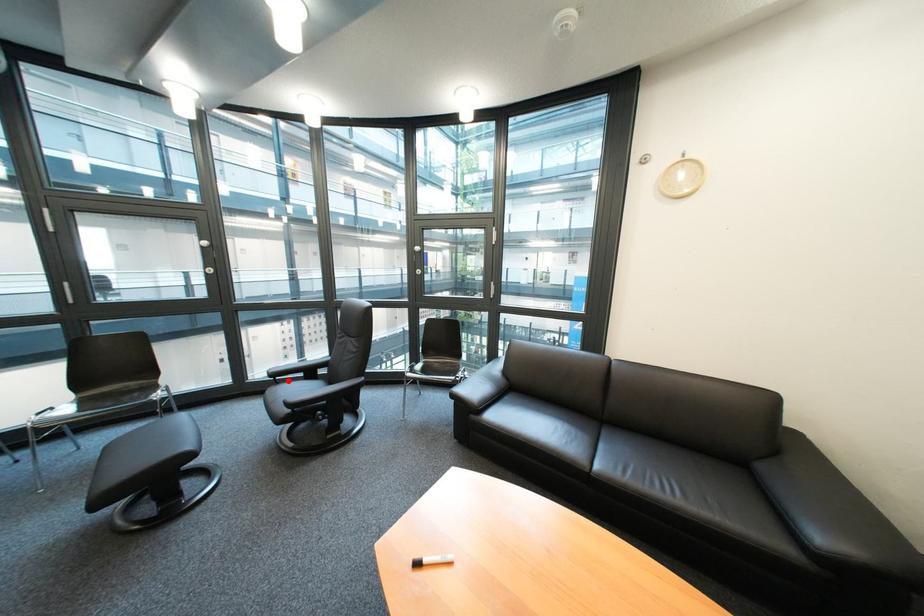
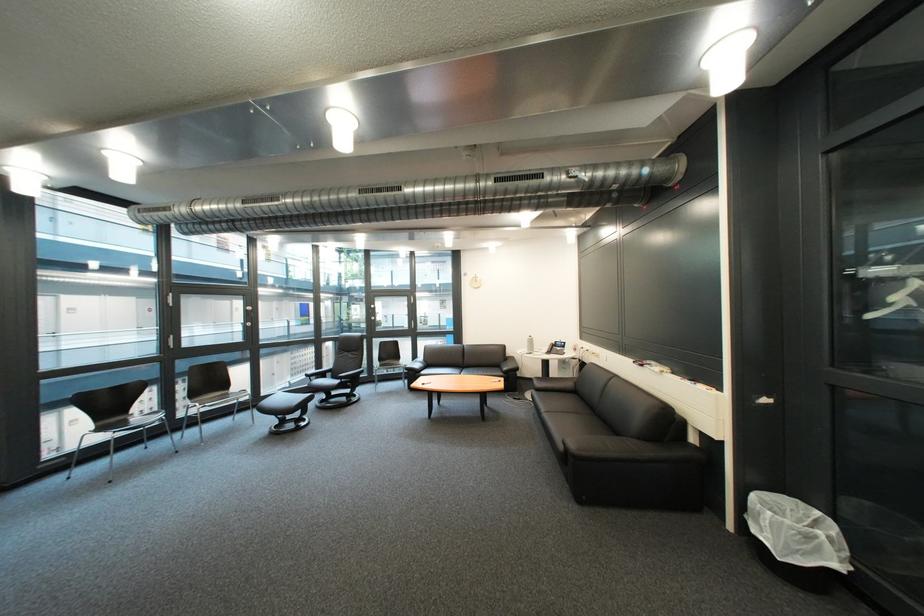
Question: I am providing you with two images of the same scene from different viewpoints. Image1 has a red point marked. In image2, the corresponding 3D location appears at what relative position? Reply with the corresponding letter.

Choices:
 (A) Closer
 (B) Farther

Answer: (B)